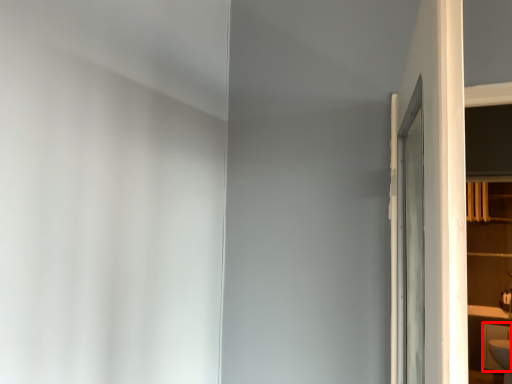
Question: From the image's perspective, what is the correct spatial positioning of cabinetry (annotated by the red box) in reference to shelf?

Choices:
 (A) below
 (B) above

Answer: (A)